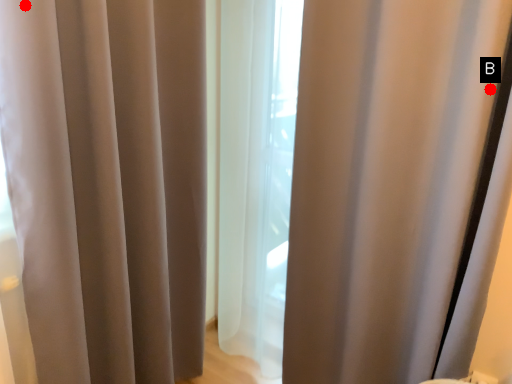
Question: Two points are circled on the image, labeled by A and B beside each circle. Which point is farther from the camera taking this photo?

Choices:
 (A) A is further
 (B) B is further

Answer: (B)